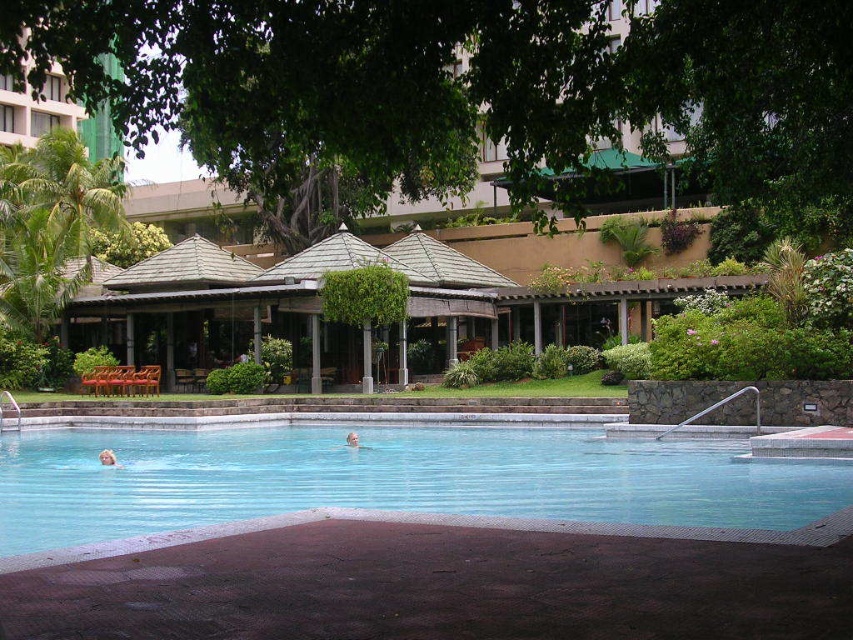
Question: Is light brown skin at lower center positioned in front of light brown skin at center?

Choices:
 (A) no
 (B) yes

Answer: (B)

Question: Which object is closer to the camera taking this photo?

Choices:
 (A) clear blue water at center
 (B) light brown skin at lower center
 (C) light brown skin at center

Answer: (A)

Question: Is light brown skin at lower center below light brown skin at center?

Choices:
 (A) yes
 (B) no

Answer: (A)

Question: Does clear blue water at center appear under light brown skin at center?

Choices:
 (A) yes
 (B) no

Answer: (B)

Question: Which point appears closest to the camera in this image?

Choices:
 (A) (99, 458)
 (B) (350, 444)

Answer: (A)

Question: Which point is farther from the camera taking this photo?

Choices:
 (A) (355, 448)
 (B) (109, 465)
 (C) (451, 497)

Answer: (A)